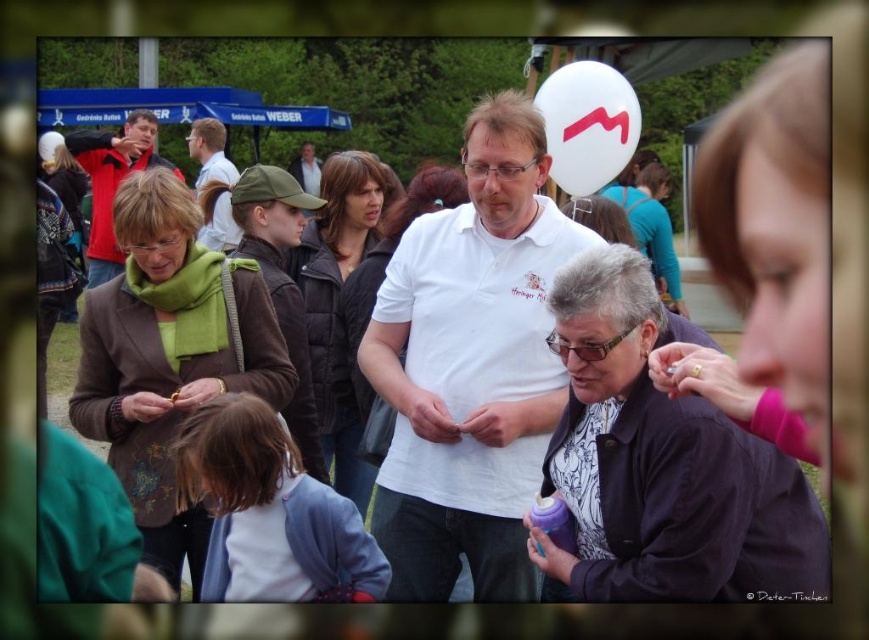
Is white matte shirt at center bigger than matte brown jacket at upper left?

Incorrect, white matte shirt at center is not larger than matte brown jacket at upper left.

Between white matte shirt at center and matte brown jacket at upper left, which one has less height?

white matte shirt at center

Is point (647, 486) farther from camera compared to point (91, 259)?

No, it is not.

What are the coordinates of `white matte shirt at center` in the screenshot? It's located at (662, 461).

Can you confirm if matte green scarf at left is smaller than brown quilted jacket at center?

No, matte green scarf at left is not smaller than brown quilted jacket at center.

Which of these two, matte green scarf at left or brown quilted jacket at center, stands taller?

With more height is brown quilted jacket at center.

Is point (180, 340) more distant than point (377, 180)?

No, (180, 340) is in front of (377, 180).

You are a GUI agent. You are given a task and a screenshot of the screen. Output one action in this format:
    pyautogui.click(x=<x>, y=<y>)
    Task: Click on the matte green scarf at left
    This screenshot has width=869, height=640.
    Given the screenshot: What is the action you would take?
    pyautogui.click(x=169, y=356)

Does white cotton shirt at center appear under white matte shirt at center?

Actually, white cotton shirt at center is above white matte shirt at center.

The image size is (869, 640). I want to click on white cotton shirt at center, so click(x=469, y=365).

This screenshot has height=640, width=869. Find the location of `white cotton shirt at center`. white cotton shirt at center is located at coordinates (469, 365).

Where is `white cotton shirt at center`? The width and height of the screenshot is (869, 640). white cotton shirt at center is located at coordinates (469, 365).